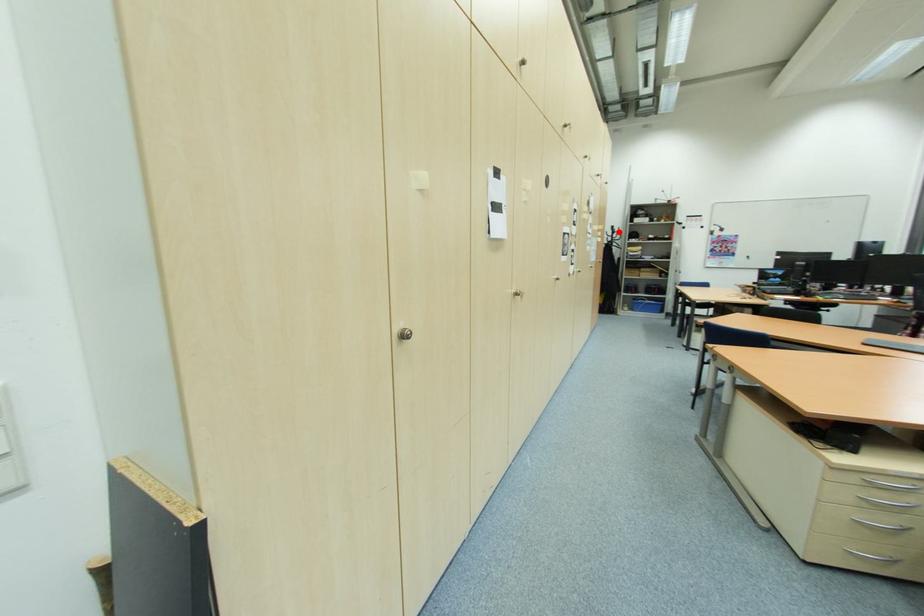
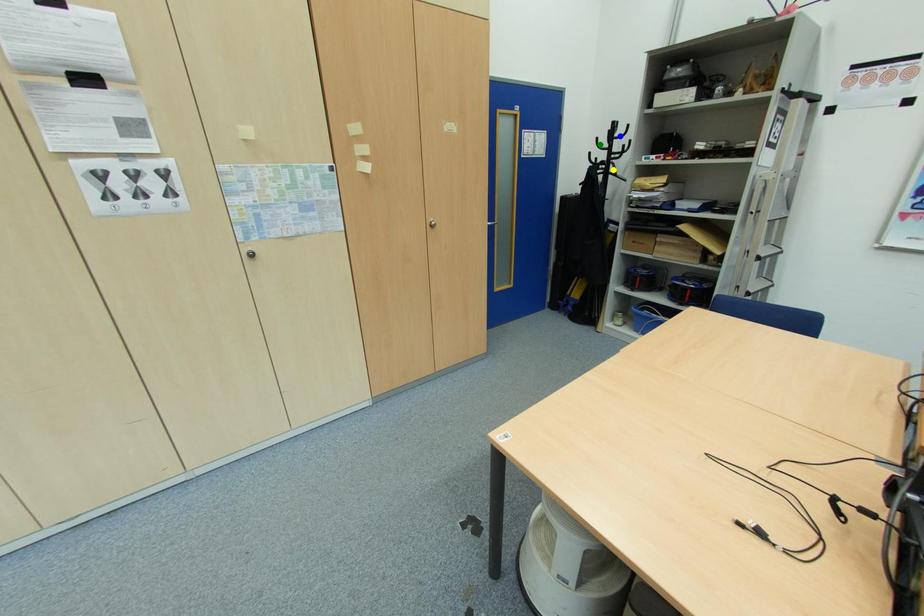
Question: I am providing you with two images of the same scene from different viewpoints. A red point is marked on the first image. You are given multiple points on the second image. Which point in image 2 represents the same 3d spot as the red point in image 1?

Choices:
 (A) blue point
 (B) yellow point
 (C) green point

Answer: (A)